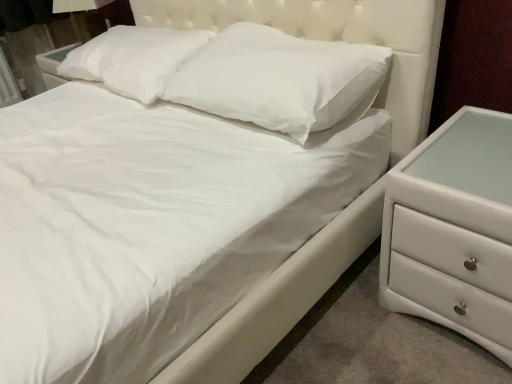
Locate an element on the screen. The width and height of the screenshot is (512, 384). white soft pillow at center, the first pillow when ordered from right to left is located at coordinates (278, 79).

At what (x,y) coordinates should I click in order to perform the action: click on white glossy chest of drawers at right. Please return your answer as a coordinate pair (x, y). This screenshot has width=512, height=384. Looking at the image, I should click on (454, 230).

Considering the positions of points (150, 77) and (313, 117), is point (150, 77) closer to camera compared to point (313, 117)?

No, it is not.

In the scene shown: From a real-world perspective, is white soft pillow at upper center, acting as the 1th pillow starting from the left, above or below white soft pillow at center, positioned as the 2th pillow in left-to-right order?

In terms of real-world spatial position, white soft pillow at upper center, acting as the 1th pillow starting from the left, is below white soft pillow at center, positioned as the 2th pillow in left-to-right order.

Based on the photo, does white soft pillow at upper center, acting as the second pillow starting from the right, have a smaller size compared to white soft pillow at center, positioned as the 2th pillow in left-to-right order?

Indeed, white soft pillow at upper center, acting as the second pillow starting from the right, has a smaller size compared to white soft pillow at center, positioned as the 2th pillow in left-to-right order.

Locate an element on the screen. pillow lying above the white soft pillow at center, positioned as the 2th pillow in left-to-right order (from the image's perspective) is located at coordinates (133, 59).

Does white soft pillow at center, the first pillow when ordered from right to left, come in front of white soft pillow at upper center, acting as the 1th pillow starting from the left?

Yes, the depth of white soft pillow at center, the first pillow when ordered from right to left, is less than that of white soft pillow at upper center, acting as the 1th pillow starting from the left.

Can you confirm if white soft pillow at center, the first pillow when ordered from right to left, is positioned to the left of white soft pillow at upper center, acting as the second pillow starting from the right?

No, white soft pillow at center, the first pillow when ordered from right to left, is not to the left of white soft pillow at upper center, acting as the second pillow starting from the right.

Between white soft pillow at center, positioned as the 2th pillow in left-to-right order, and white soft pillow at upper center, acting as the second pillow starting from the right, which one has larger width?

With larger width is white soft pillow at upper center, acting as the second pillow starting from the right.

From the image's perspective, is white soft pillow at center, the first pillow when ordered from right to left, located beneath white soft pillow at upper center, acting as the 1th pillow starting from the left?

Yes.

Is white glossy chest of drawers at right oriented towards white soft pillow at center, the first pillow when ordered from right to left?

No, white glossy chest of drawers at right is not aimed at white soft pillow at center, the first pillow when ordered from right to left.

Consider the image. Would you say white glossy chest of drawers at right is outside white soft pillow at center, positioned as the 2th pillow in left-to-right order?

Indeed, white glossy chest of drawers at right is completely outside white soft pillow at center, positioned as the 2th pillow in left-to-right order.

In the scene shown: From the image's perspective, would you say white glossy chest of drawers at right is positioned over white soft pillow at center, positioned as the 2th pillow in left-to-right order?

No, from the image's perspective, white glossy chest of drawers at right is not above white soft pillow at center, positioned as the 2th pillow in left-to-right order.

The height and width of the screenshot is (384, 512). What are the coordinates of `the chest of drawers located in front of the white soft pillow at center, positioned as the 2th pillow in left-to-right order` in the screenshot? It's located at (454, 230).

From a real-world perspective, is white soft pillow at center, positioned as the 2th pillow in left-to-right order, above or below white glossy chest of drawers at right?

white soft pillow at center, positioned as the 2th pillow in left-to-right order, is above white glossy chest of drawers at right.

Is white soft pillow at center, positioned as the 2th pillow in left-to-right order, thinner than white glossy chest of drawers at right?

Correct, the width of white soft pillow at center, positioned as the 2th pillow in left-to-right order, is less than that of white glossy chest of drawers at right.

Is white soft pillow at center, positioned as the 2th pillow in left-to-right order, located outside white glossy chest of drawers at right?

That's correct, white soft pillow at center, positioned as the 2th pillow in left-to-right order, is outside of white glossy chest of drawers at right.

Which of these two, white soft pillow at center, the first pillow when ordered from right to left, or white glossy chest of drawers at right, stands taller?

white glossy chest of drawers at right.

From the picture: Considering their positions, is white glossy chest of drawers at right located in front of or behind white soft pillow at upper center, acting as the second pillow starting from the right?

Visually, white glossy chest of drawers at right is located in front of white soft pillow at upper center, acting as the second pillow starting from the right.

Which point is more forward, (412, 240) or (108, 56)?

Point (412, 240)

How far apart are white glossy chest of drawers at right and white soft pillow at upper center, acting as the second pillow starting from the right?

1.07 meters.

Which object is thinner, white glossy chest of drawers at right or white soft pillow at upper center, acting as the second pillow starting from the right?

white soft pillow at upper center, acting as the second pillow starting from the right, is thinner.

Is white glossy chest of drawers at right at the back of white soft pillow at upper center, acting as the second pillow starting from the right?

white soft pillow at upper center, acting as the second pillow starting from the right, is not turned away from white glossy chest of drawers at right.

Based on the photo, from the image's perspective, is white soft pillow at upper center, acting as the 1th pillow starting from the left, located beneath white glossy chest of drawers at right?

No, from the image's perspective, white soft pillow at upper center, acting as the 1th pillow starting from the left, is not below white glossy chest of drawers at right.

In the scene shown: Is white soft pillow at upper center, acting as the second pillow starting from the right, touching white glossy chest of drawers at right?

No, white soft pillow at upper center, acting as the second pillow starting from the right, is not touching white glossy chest of drawers at right.

Where is `pillow on the left of white soft pillow at center, the first pillow when ordered from right to left`? Image resolution: width=512 pixels, height=384 pixels. pillow on the left of white soft pillow at center, the first pillow when ordered from right to left is located at coordinates (133, 59).

You are a GUI agent. You are given a task and a screenshot of the screen. Output one action in this format:
    pyautogui.click(x=<x>, y=<y>)
    Task: Click on the pillow above the white soft pillow at upper center, acting as the 1th pillow starting from the left (from a real-world perspective)
    This screenshot has width=512, height=384.
    Given the screenshot: What is the action you would take?
    pyautogui.click(x=278, y=79)

Based on their spatial positions, is white soft pillow at center, the first pillow when ordered from right to left, or white glossy chest of drawers at right further from white soft pillow at upper center, acting as the second pillow starting from the right?

Among the two, white glossy chest of drawers at right is located further to white soft pillow at upper center, acting as the second pillow starting from the right.

Which object lies further to the anchor point white soft pillow at center, positioned as the 2th pillow in left-to-right order, white glossy chest of drawers at right or white soft pillow at upper center, acting as the second pillow starting from the right?

Based on the image, white glossy chest of drawers at right appears to be further to white soft pillow at center, positioned as the 2th pillow in left-to-right order.

From the image, which object appears to be farther from white soft pillow at upper center, acting as the 1th pillow starting from the left, white glossy chest of drawers at right or white soft pillow at center, the first pillow when ordered from right to left?

Based on the image, white glossy chest of drawers at right appears to be further to white soft pillow at upper center, acting as the 1th pillow starting from the left.

Considering their positions, is white soft pillow at upper center, acting as the second pillow starting from the right, positioned closer to white glossy chest of drawers at right than white soft pillow at center, the first pillow when ordered from right to left?

white soft pillow at center, the first pillow when ordered from right to left, lies closer to white glossy chest of drawers at right than the other object.

Estimate the real-world distances between objects in this image. Which object is closer to white soft pillow at center, positioned as the 2th pillow in left-to-right order, white soft pillow at upper center, acting as the second pillow starting from the right, or white glossy chest of drawers at right?

Result: white soft pillow at upper center, acting as the second pillow starting from the right, is closer to white soft pillow at center, positioned as the 2th pillow in left-to-right order.

Which object lies nearer to the anchor point white glossy chest of drawers at right, white soft pillow at center, the first pillow when ordered from right to left, or white soft pillow at upper center, acting as the 1th pillow starting from the left?

The object closer to white glossy chest of drawers at right is white soft pillow at center, the first pillow when ordered from right to left.

This screenshot has height=384, width=512. Identify the location of pillow between white soft pillow at upper center, acting as the second pillow starting from the right, and white glossy chest of drawers at right, in the horizontal direction. (278, 79).